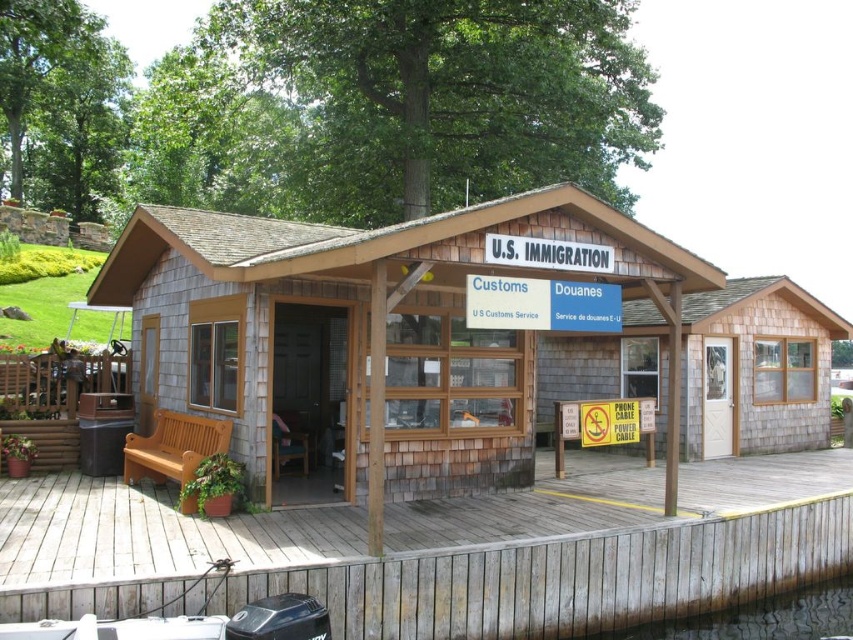
Question: Among these points, which one is farthest from the camera?

Choices:
 (A) coord(764,480)
 (B) coord(376,248)
 (C) coord(786,596)

Answer: (A)

Question: Which is farther from the clear water at dock lower?

Choices:
 (A) shingled wood cabin at center
 (B) wooden at center

Answer: (A)

Question: Considering the relative positions of wooden at center and clear water at dock lower in the image provided, where is wooden at center located with respect to clear water at dock lower?

Choices:
 (A) above
 (B) below

Answer: (A)

Question: Is wooden at center closer to the viewer compared to clear water at dock lower?

Choices:
 (A) yes
 (B) no

Answer: (A)

Question: Which is farther from the wooden at center?

Choices:
 (A) clear water at dock lower
 (B) shingled wood cabin at center

Answer: (B)

Question: Does wooden at center appear over shingled wood cabin at center?

Choices:
 (A) yes
 (B) no

Answer: (B)